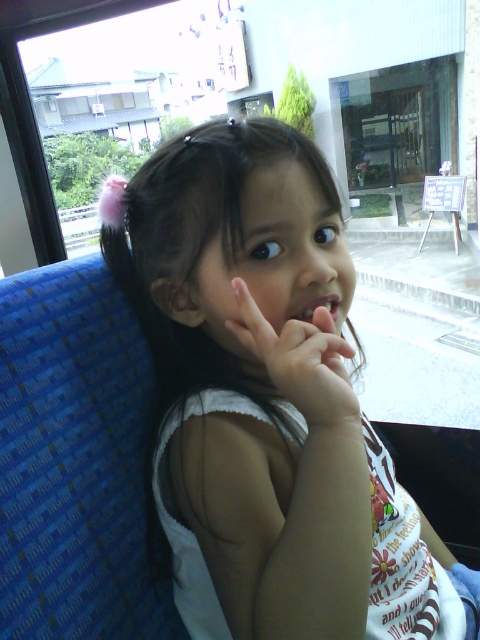
Question: Does white fabric shirt at center have a smaller size compared to white matte hand at center?

Choices:
 (A) yes
 (B) no

Answer: (B)

Question: Based on their relative distances, which object is farther from the white matte hand at center?

Choices:
 (A) white fabric shirt at center
 (B) matte pink lips at center

Answer: (A)

Question: Is the position of white fabric shirt at center less distant than that of white matte hand at center?

Choices:
 (A) yes
 (B) no

Answer: (A)

Question: Which point is closer to the camera taking this photo?

Choices:
 (A) click(x=235, y=323)
 (B) click(x=284, y=384)

Answer: (B)

Question: Which of the following is the farthest from the observer?

Choices:
 (A) white matte hand at center
 (B) white fabric shirt at center
 (C) matte pink lips at center

Answer: (C)

Question: Does white matte hand at center appear on the right side of matte pink lips at center?

Choices:
 (A) yes
 (B) no

Answer: (B)